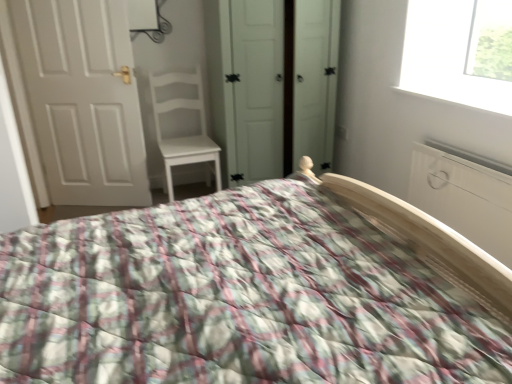
Question: Can you confirm if white matte wardrobe at center is bigger than white matte chair at center?

Choices:
 (A) yes
 (B) no

Answer: (A)

Question: Can you confirm if white matte wardrobe at center is taller than white matte chair at center?

Choices:
 (A) yes
 (B) no

Answer: (A)

Question: Is white matte chair at center completely or partially inside white matte wardrobe at center?

Choices:
 (A) yes
 (B) no

Answer: (B)

Question: Can you confirm if white matte wardrobe at center is shorter than white matte chair at center?

Choices:
 (A) yes
 (B) no

Answer: (B)

Question: Considering the relative sizes of white matte wardrobe at center and white matte chair at center in the image provided, is white matte wardrobe at center smaller than white matte chair at center?

Choices:
 (A) no
 (B) yes

Answer: (A)

Question: Considering the relative positions of white matte chair at center and white matte wardrobe at center in the image provided, is white matte chair at center to the left or to the right of white matte wardrobe at center?

Choices:
 (A) left
 (B) right

Answer: (A)

Question: From their relative heights in the image, would you say white matte chair at center is taller or shorter than white matte wardrobe at center?

Choices:
 (A) short
 (B) tall

Answer: (A)

Question: Is white matte chair at center in front of or behind white matte wardrobe at center in the image?

Choices:
 (A) front
 (B) behind

Answer: (B)

Question: From the image's perspective, is white matte chair at center above or below white matte wardrobe at center?

Choices:
 (A) above
 (B) below

Answer: (B)

Question: In the image, is white matte wardrobe at center positioned in front of or behind white matte chair at center?

Choices:
 (A) front
 (B) behind

Answer: (A)

Question: From a real-world perspective, relative to white matte chair at center, is white matte wardrobe at center vertically above or below?

Choices:
 (A) above
 (B) below

Answer: (A)

Question: From the image's perspective, relative to white matte chair at center, is white matte wardrobe at center above or below?

Choices:
 (A) above
 (B) below

Answer: (A)

Question: Is white matte wardrobe at center wider or thinner than white matte chair at center?

Choices:
 (A) thin
 (B) wide

Answer: (B)

Question: Based on their sizes in the image, would you say fluffy quilted bed at center is bigger or smaller than white matte chair at center?

Choices:
 (A) big
 (B) small

Answer: (A)

Question: Would you say fluffy quilted bed at center is to the left or to the right of white matte chair at center in the picture?

Choices:
 (A) right
 (B) left

Answer: (A)